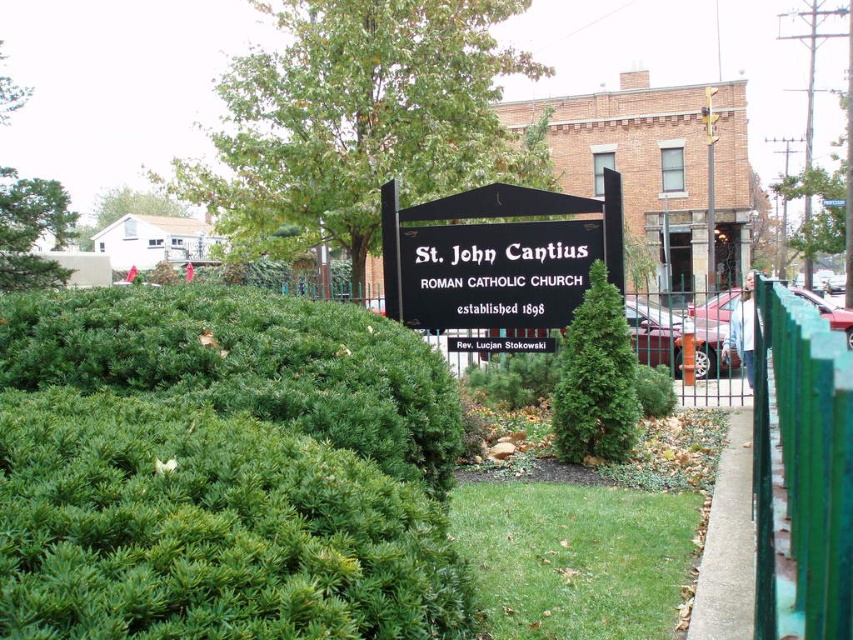
Question: Is green leafy hedge at center below green painted wood fence at right?

Choices:
 (A) yes
 (B) no

Answer: (B)

Question: Does green leafy hedge at center have a greater width compared to green textured bush at center?

Choices:
 (A) no
 (B) yes

Answer: (B)

Question: Which of these objects is positioned farthest from the black matte sign at center?

Choices:
 (A) green leafy hedge at center
 (B) green painted wood fence at right

Answer: (A)

Question: Is green painted wood fence at right behind black matte sign at center?

Choices:
 (A) no
 (B) yes

Answer: (A)

Question: Which point is farther from the camera taking this photo?

Choices:
 (A) (775, 468)
 (B) (595, 310)
 (C) (7, 486)
 (D) (535, 225)

Answer: (D)

Question: Which object is positioned closest to the black matte sign at center?

Choices:
 (A) green leafy hedge at center
 (B) green painted wood fence at right

Answer: (B)